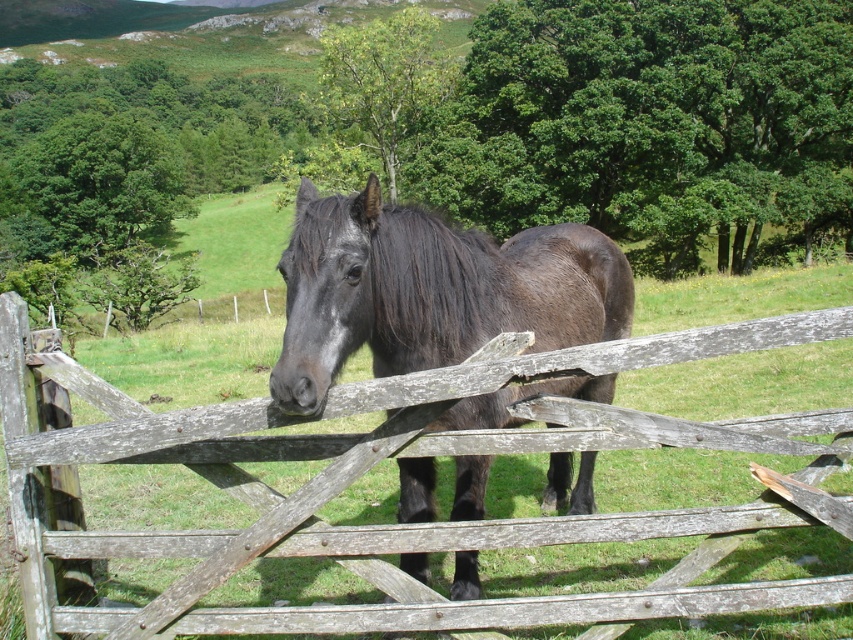
Question: Is weathered wood fence at center bigger than shiny black horse at center?

Choices:
 (A) no
 (B) yes

Answer: (B)

Question: Is weathered wood fence at center closer to camera compared to shiny black horse at center?

Choices:
 (A) no
 (B) yes

Answer: (B)

Question: Which of the following is the farthest from the observer?

Choices:
 (A) shiny black horse at center
 (B) weathered wood fence at center

Answer: (A)

Question: Which object is closer to the camera taking this photo?

Choices:
 (A) shiny black horse at center
 (B) weathered wood fence at center

Answer: (B)

Question: Does weathered wood fence at center lie in front of shiny black horse at center?

Choices:
 (A) no
 (B) yes

Answer: (B)